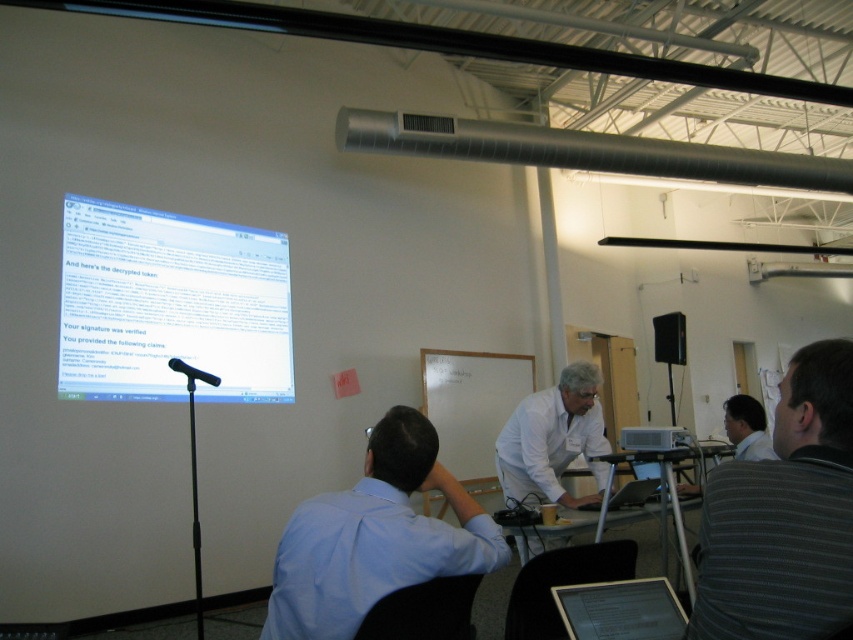
The image size is (853, 640). Describe the element at coordinates (375, 536) in the screenshot. I see `light blue shirt at center` at that location.

Measure the distance from light blue shirt at center to silver metallic laptop at center.

The distance of light blue shirt at center from silver metallic laptop at center is 1.59 meters.

What do you see at coordinates (375, 536) in the screenshot? The height and width of the screenshot is (640, 853). I see `light blue shirt at center` at bounding box center [375, 536].

Where is `light blue shirt at center`? The width and height of the screenshot is (853, 640). light blue shirt at center is located at coordinates [375, 536].

Where is `white glossy projector screen at upper left`? This screenshot has height=640, width=853. white glossy projector screen at upper left is located at coordinates (x=170, y=305).

Which is more to the left, white glossy projector screen at upper left or metallic silver table at center?

white glossy projector screen at upper left is more to the left.

What do you see at coordinates (170, 305) in the screenshot? I see `white glossy projector screen at upper left` at bounding box center [170, 305].

What are the coordinates of `white glossy projector screen at upper left` in the screenshot? It's located at (170, 305).

Is white matte shirt at center shorter than metallic silver table at center?

Incorrect, white matte shirt at center's height does not fall short of metallic silver table at center's.

Is white matte shirt at center above metallic silver table at center?

Yes, white matte shirt at center is above metallic silver table at center.

What do you see at coordinates (553, 440) in the screenshot?
I see `white matte shirt at center` at bounding box center [553, 440].

I want to click on white matte shirt at center, so click(553, 440).